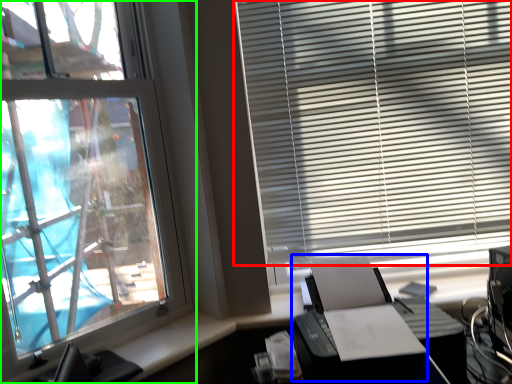
Question: Which object is the farthest from window blind (highlighted by a red box)? Choose among these: printer (highlighted by a blue box) or window (highlighted by a green box).

Choices:
 (A) printer
 (B) window

Answer: (B)